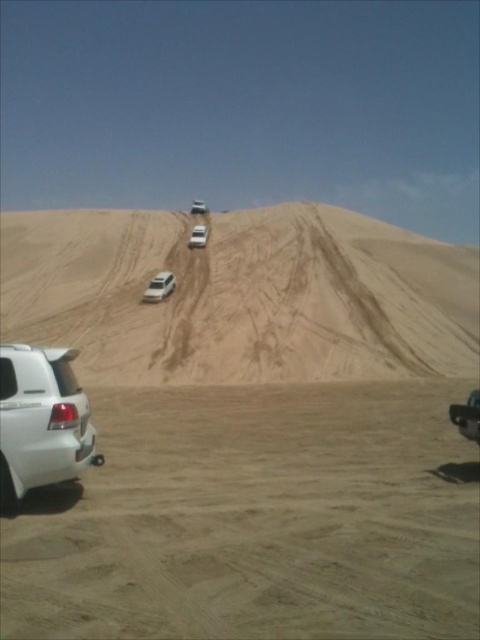
Which of these two, white sand dirt track at lower left or metallic silver car at lower right, stands shorter?

white sand dirt track at lower left is shorter.

Is point (135, 449) positioned after point (460, 410)?

Yes, point (135, 449) is behind point (460, 410).

At what (x,y) coordinates should I click in order to perform the action: click on white sand dirt track at lower left. Please return your answer as a coordinate pair (x, y). This screenshot has width=480, height=640. Looking at the image, I should click on (255, 518).

Who is more forward, (110,355) or (28,456)?

Point (28,456) is more forward.

Who is higher up, sandy/dry sand dune at center or white matte suv at lower left?

sandy/dry sand dune at center is higher up.

This screenshot has width=480, height=640. What are the coordinates of `sandy/dry sand dune at center` in the screenshot? It's located at click(241, 294).

What are the coordinates of `sandy/dry sand dune at center` in the screenshot? It's located at (241, 294).

Which is more to the right, metallic silver car at lower right or white matte car at upper center?

From the viewer's perspective, metallic silver car at lower right appears more on the right side.

What are the coordinates of `metallic silver car at lower right` in the screenshot? It's located at (467, 417).